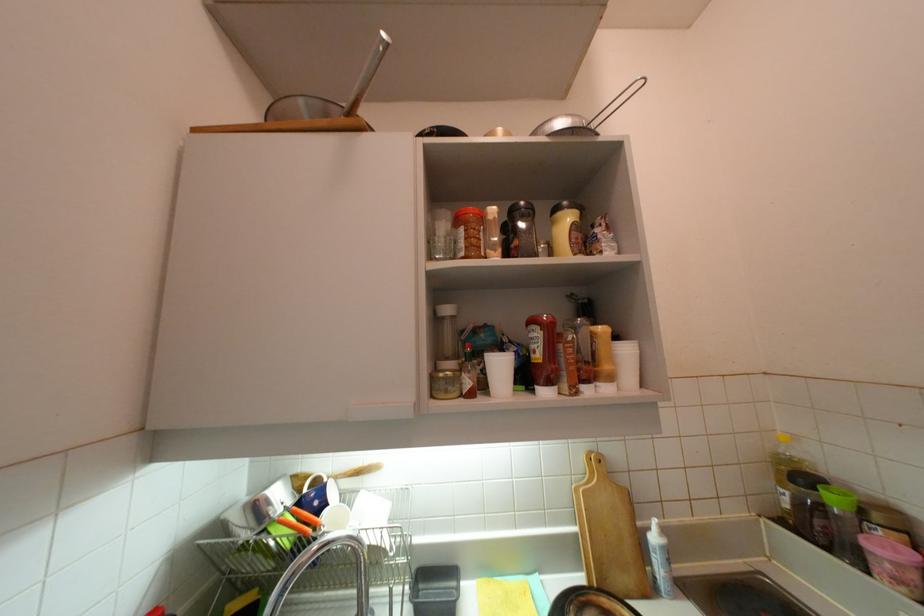
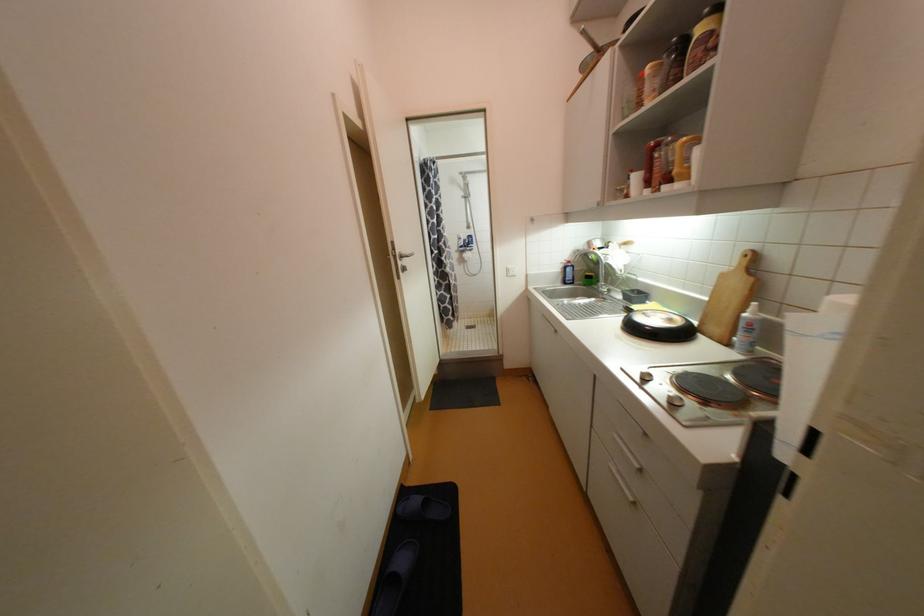
Find the pixel in the second image that matches point (660, 540) in the first image.

(750, 315)